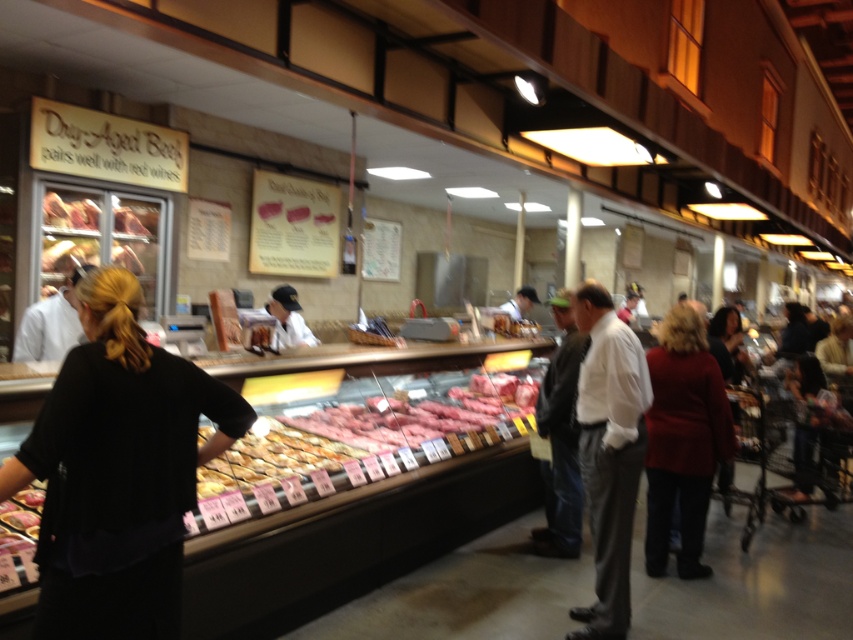
Question: Is golden brown bread at center below white uniform at center?

Choices:
 (A) yes
 (B) no

Answer: (A)

Question: Is red wool coat at center bigger than white uniform at center?

Choices:
 (A) yes
 (B) no

Answer: (A)

Question: Estimate the real-world distances between objects in this image. Which object is farther from the red wool coat at center?

Choices:
 (A) smoked ham at center
 (B) white uniform at center

Answer: (A)

Question: Does pink glossy meat at center appear on the right side of golden brown bread at center?

Choices:
 (A) no
 (B) yes

Answer: (B)

Question: Which of the following is the closest to the observer?

Choices:
 (A) pink glossy meat at center
 (B) white uniform at center
 (C) smoked ham at center

Answer: (A)

Question: Which is nearer to the pink glossy meat at center?

Choices:
 (A) white shirt at center
 (B) black fabric at left
 (C) red wool coat at center

Answer: (C)